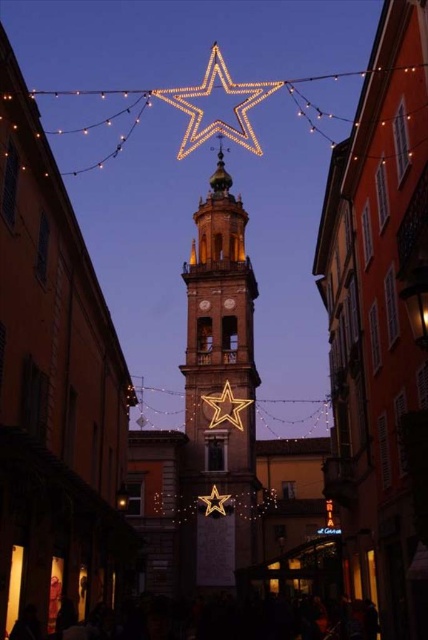
You are a delivery drone with a maximum flight range of 100 meters. You need to deliver a package to the gold metallic bell tower at center. Can you reach it from your current position?

The distance between you and the gold metallic bell tower at center is 103.55 meters, which exceeds your maximum flight range of 100 meters. Therefore, you cannot reach it.

You are an architect designing a new lighting plan for the town square. You need to place a new spotlight to highlight the star that is smaller between the illuminated gold star at center and the gold metallic star at center. Which star should you focus the spotlight on?

The gold metallic star at center is smaller than the illuminated gold star at center, so you should focus the spotlight on the gold metallic star at center to highlight its details.

You are a tourist standing in the middle of the street looking at the festive scene. You notice the gold metallic bell tower at center and the gold metallic star at center. Which object is placed higher in the scene?

The gold metallic bell tower at center is positioned over the gold metallic star at center, meaning it is higher up in the scene.